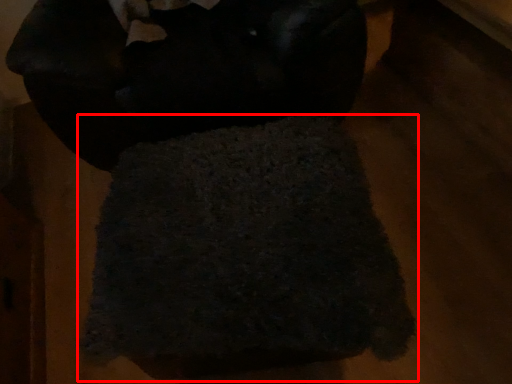
Question: Considering the relative positions of towel (annotated by the red box) and wool in the image provided, where is towel (annotated by the red box) located with respect to the staircase?

Choices:
 (A) right
 (B) left

Answer: (A)